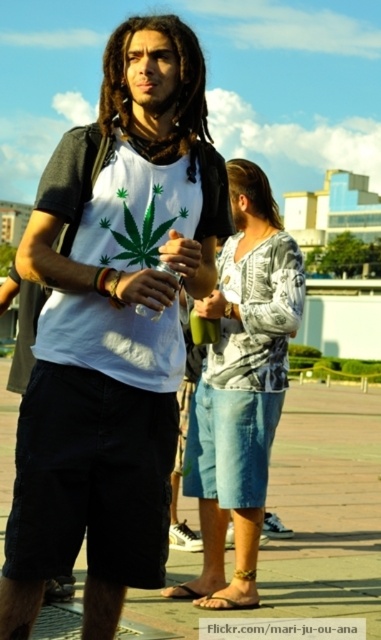
Can you confirm if brown/dry/dreadlocks at center is thinner than brown wavy hair at upper center?

Correct, brown/dry/dreadlocks at center's width is less than brown wavy hair at upper center's.

Can you confirm if brown/dry/dreadlocks at center is positioned below brown wavy hair at upper center?

Yes, brown/dry/dreadlocks at center is below brown wavy hair at upper center.

In order to click on brown/dry/dreadlocks at center in this screenshot , I will do `click(163, 99)`.

Between denim shorts at center and brown wavy hair at upper center, which one appears on the right side from the viewer's perspective?

From the viewer's perspective, brown wavy hair at upper center appears more on the right side.

Which is above, denim shorts at center or brown wavy hair at upper center?

Positioned higher is brown wavy hair at upper center.

Is point (248, 340) closer to camera compared to point (259, 195)?

Yes, it is in front of point (259, 195).

The height and width of the screenshot is (640, 381). Identify the location of denim shorts at center. (241, 387).

Between white matte t-shirt at center and brown wavy hair at upper center, which one appears on the right side from the viewer's perspective?

brown wavy hair at upper center

Between point (44, 312) and point (259, 208), which one is positioned in front?

Point (44, 312) is in front.

At what (x,y) coordinates should I click in order to perform the action: click on white matte t-shirt at center. Please return your answer as a coordinate pair (x, y). Image resolution: width=381 pixels, height=640 pixels. Looking at the image, I should click on (113, 326).